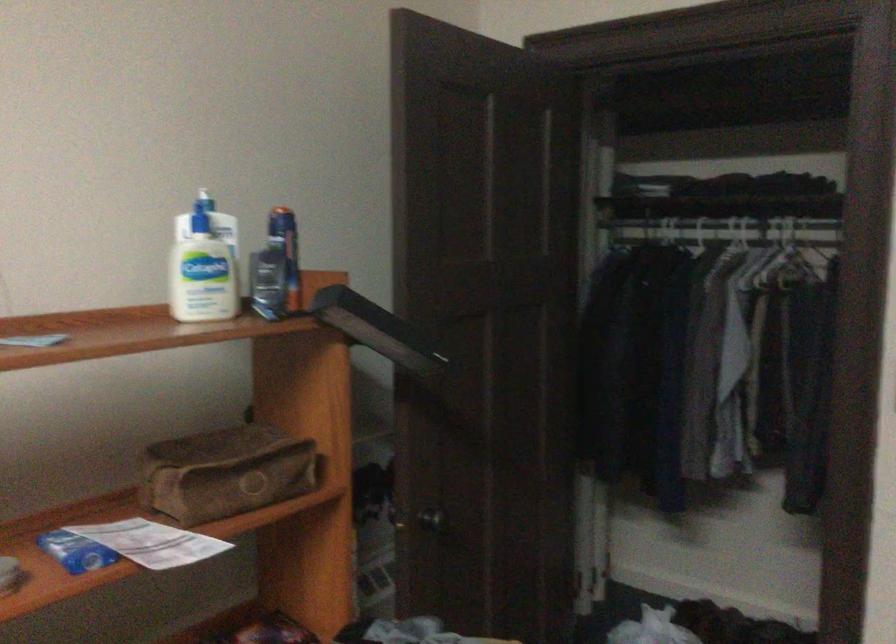
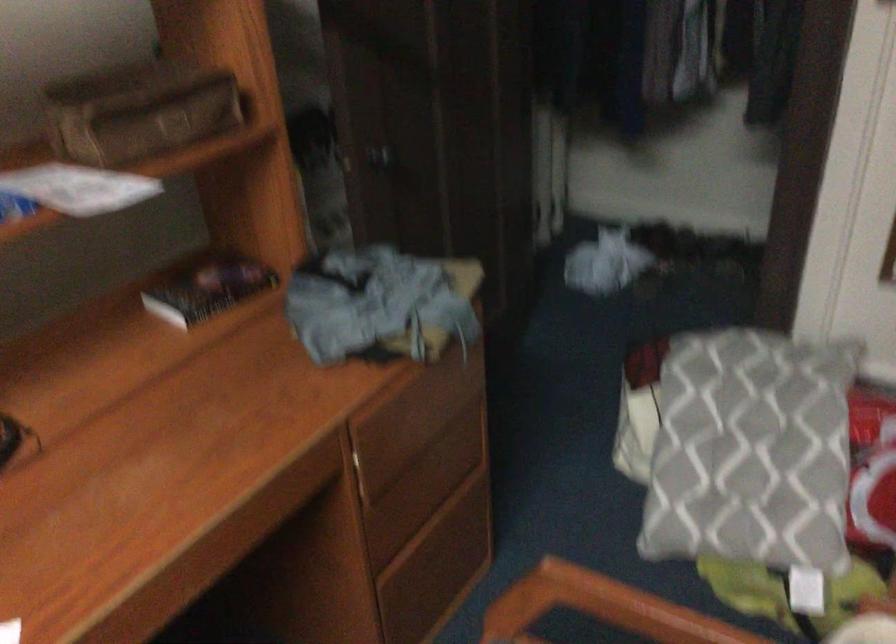
In a continuous first-person perspective shot, in which direction is the camera moving?

The cameraman walked toward right, forward.